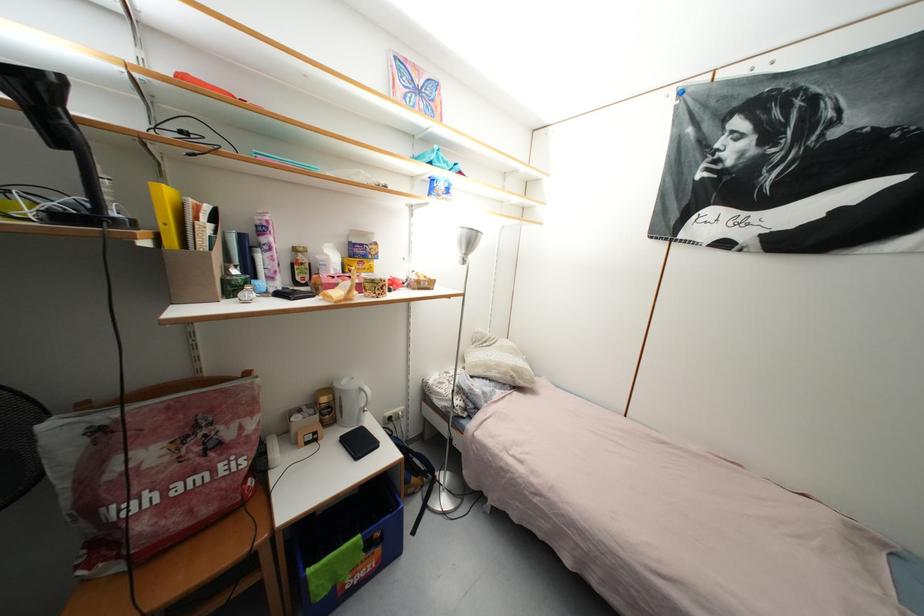
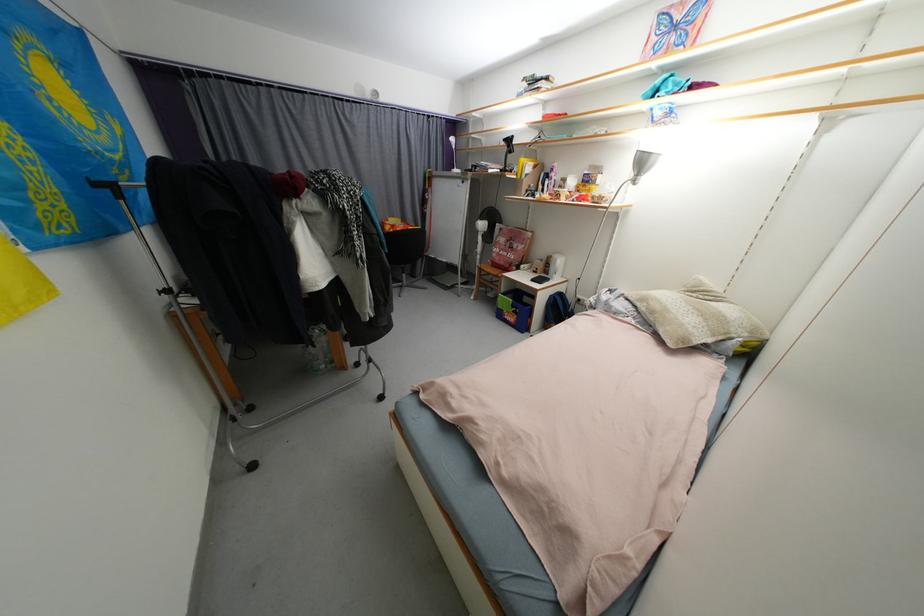
Where in the second image is the point corresponding to point (383, 552) from the first image?

(520, 318)